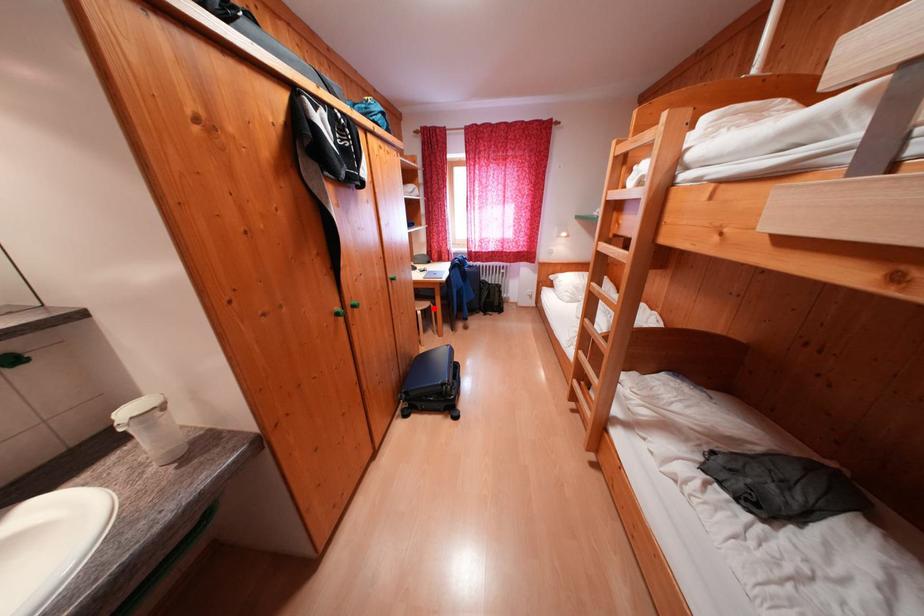
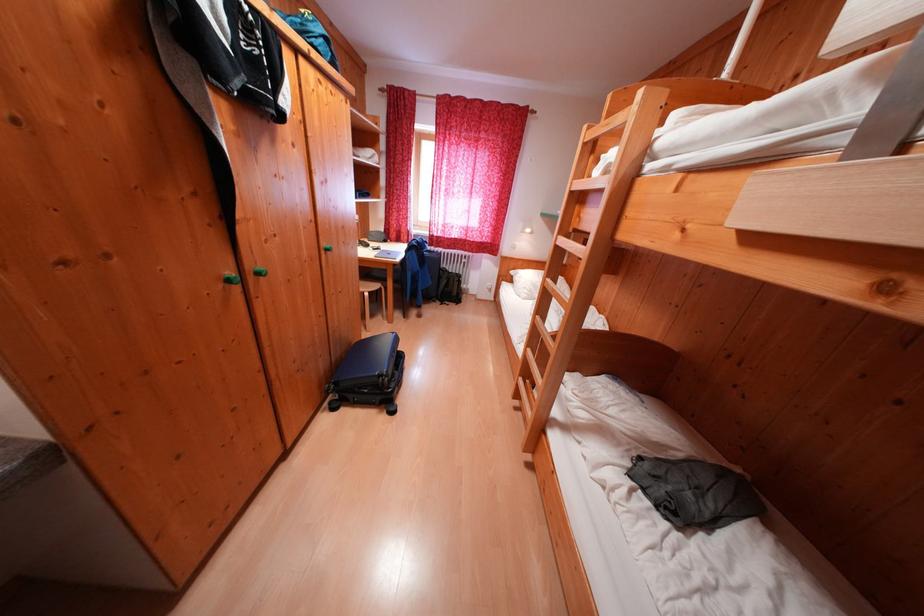
Locate, in the second image, the point that corresponds to the highlighted location in the first image.

(383, 290)